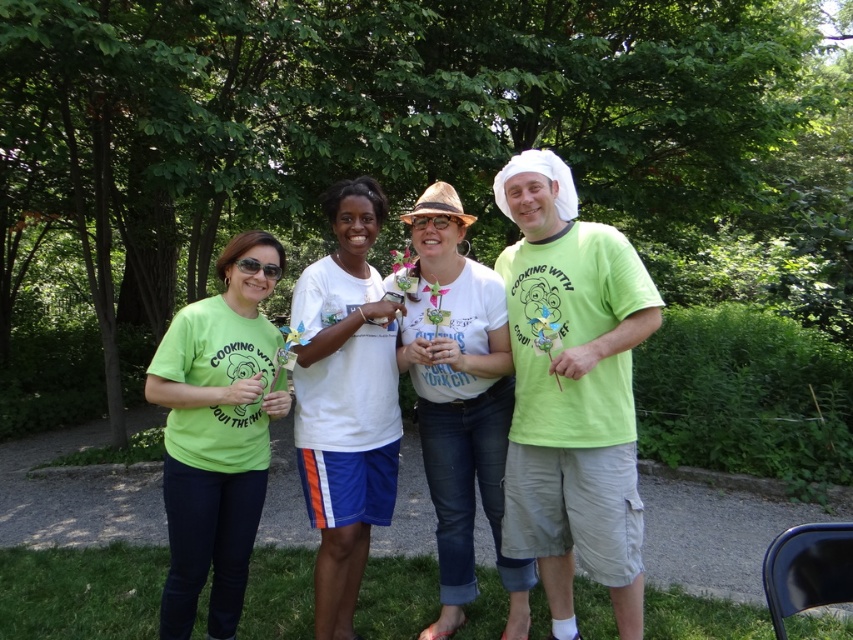
Can you confirm if matte green t-shirt at left is bigger than white cotton shirt at center?

Yes.

Is point (254, 388) closer to camera compared to point (376, 304)?

Yes, it is.

The height and width of the screenshot is (640, 853). I want to click on matte green t-shirt at left, so click(218, 433).

Who is shorter, matte green t-shirt at center or green matte t-shirt at center?

With less height is green matte t-shirt at center.

In the scene shown: Which is below, matte green t-shirt at center or green matte t-shirt at center?

matte green t-shirt at center is lower down.

Is point (635, 323) positioned after point (608, 275)?

No, (635, 323) is in front of (608, 275).

The height and width of the screenshot is (640, 853). I want to click on matte green t-shirt at center, so [534, 401].

Who is more forward, (520, 339) or (444, 269)?

Positioned in front is point (520, 339).

Measure the distance from matte green t-shirt at center to white matte hat at center.

matte green t-shirt at center is 13.47 centimeters from white matte hat at center.

Is point (496, 547) farther from viewer compared to point (422, 392)?

Yes, it is.

This screenshot has height=640, width=853. Find the location of `matte green t-shirt at center`. matte green t-shirt at center is located at coordinates (534, 401).